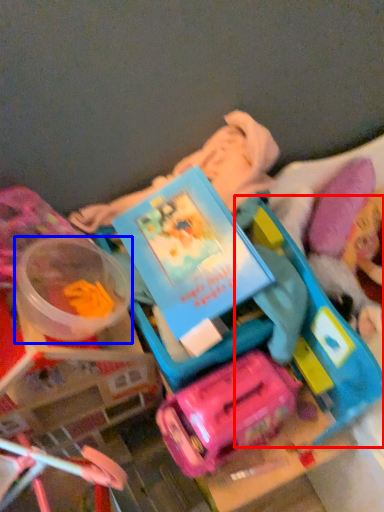
Question: Which point is further to the camera, toy (highlighted by a red box) or toy (highlighted by a blue box)?

Choices:
 (A) toy
 (B) toy

Answer: (B)